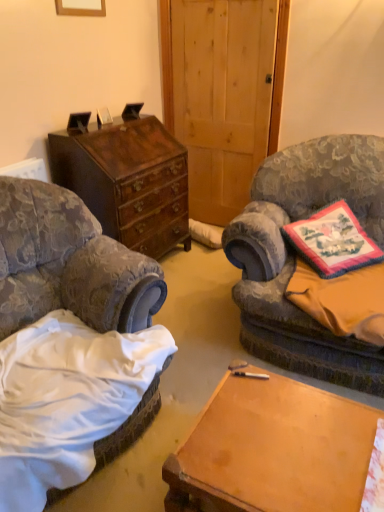
Question: Is mahogany wood chest of drawers at left wider than velvet floral chair at right, the 1th chair in the right-to-left sequence?

Choices:
 (A) yes
 (B) no

Answer: (B)

Question: Does mahogany wood chest of drawers at left have a lesser height compared to velvet floral chair at right, the second chair in the left-to-right sequence?

Choices:
 (A) no
 (B) yes

Answer: (B)

Question: From a real-world perspective, is mahogany wood chest of drawers at left beneath velvet floral chair at right, the second chair in the left-to-right sequence?

Choices:
 (A) yes
 (B) no

Answer: (A)

Question: Is mahogany wood chest of drawers at left positioned with its back to velvet floral chair at right, the second chair in the left-to-right sequence?

Choices:
 (A) yes
 (B) no

Answer: (B)

Question: Is velvet floral chair at right, the 1th chair in the right-to-left sequence, completely or partially inside mahogany wood chest of drawers at left?

Choices:
 (A) no
 (B) yes

Answer: (A)

Question: From a real-world perspective, is mahogany wood chest of drawers at left positioned above or below floral fabric sheet at lower right, marked as the 1th sheet in a bottom-to-top arrangement?

Choices:
 (A) below
 (B) above

Answer: (B)

Question: Is mahogany wood chest of drawers at left wider or thinner than floral fabric sheet at lower right, placed as the 1th sheet when sorted from front to back?

Choices:
 (A) wide
 (B) thin

Answer: (A)

Question: Relative to floral fabric sheet at lower right, marked as the 1th sheet in a bottom-to-top arrangement, is mahogany wood chest of drawers at left in front or behind?

Choices:
 (A) front
 (B) behind

Answer: (B)

Question: From their relative heights in the image, would you say mahogany wood chest of drawers at left is taller or shorter than floral fabric sheet at lower right, which is counted as the second sheet, starting from the back?

Choices:
 (A) short
 (B) tall

Answer: (B)

Question: From the image's perspective, relative to wooden desk at center, is orange fabric pillow at right, the first sheet viewed from the top, above or below?

Choices:
 (A) below
 (B) above

Answer: (B)

Question: In terms of height, does orange fabric pillow at right, the 2th sheet positioned from the bottom, look taller or shorter compared to wooden desk at center?

Choices:
 (A) short
 (B) tall

Answer: (A)

Question: Is point pyautogui.click(x=369, y=333) positioned closer to the camera than point pyautogui.click(x=249, y=431)?

Choices:
 (A) farther
 (B) closer

Answer: (A)

Question: In terms of width, does orange fabric pillow at right, arranged as the first sheet when viewed from the back, look wider or thinner when compared to wooden desk at center?

Choices:
 (A) wide
 (B) thin

Answer: (A)

Question: From a real-world perspective, is wooden desk at center above or below velvet-patterned armchair at left, which is counted as the 1th chair, starting from the left?

Choices:
 (A) above
 (B) below

Answer: (B)

Question: Considering the positions of wooden desk at center and velvet-patterned armchair at left, which appears as the 2th chair when viewed from the right, in the image, is wooden desk at center taller or shorter than velvet-patterned armchair at left, which appears as the 2th chair when viewed from the right,?

Choices:
 (A) short
 (B) tall

Answer: (A)